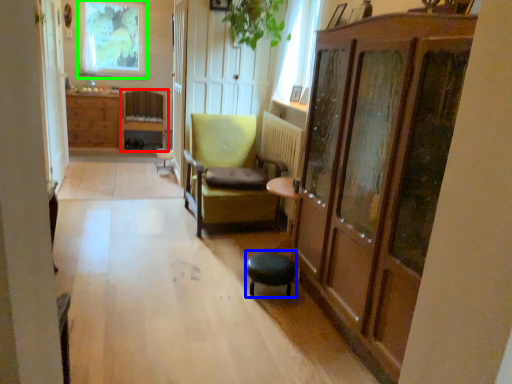
Question: Which object is positioned farthest from chair (highlighted by a red box)? Select from stool (highlighted by a blue box) and window (highlighted by a green box).

Choices:
 (A) stool
 (B) window

Answer: (A)